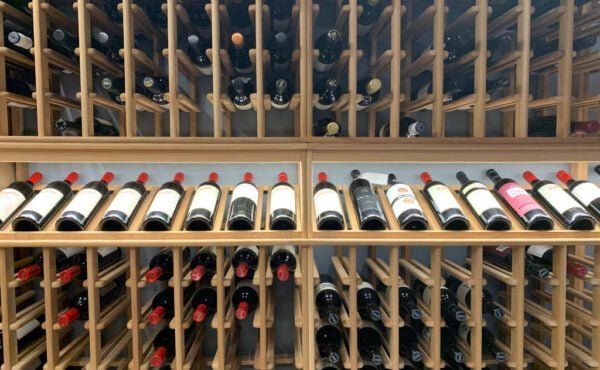
Find the location of `bottles in the middle lower left hand side of the shelving`. bottles in the middle lower left hand side of the shelving is located at coordinates (284, 269), (242, 268), (241, 312), (201, 315), (193, 275), (155, 274), (154, 317), (158, 358), (68, 275), (29, 272).